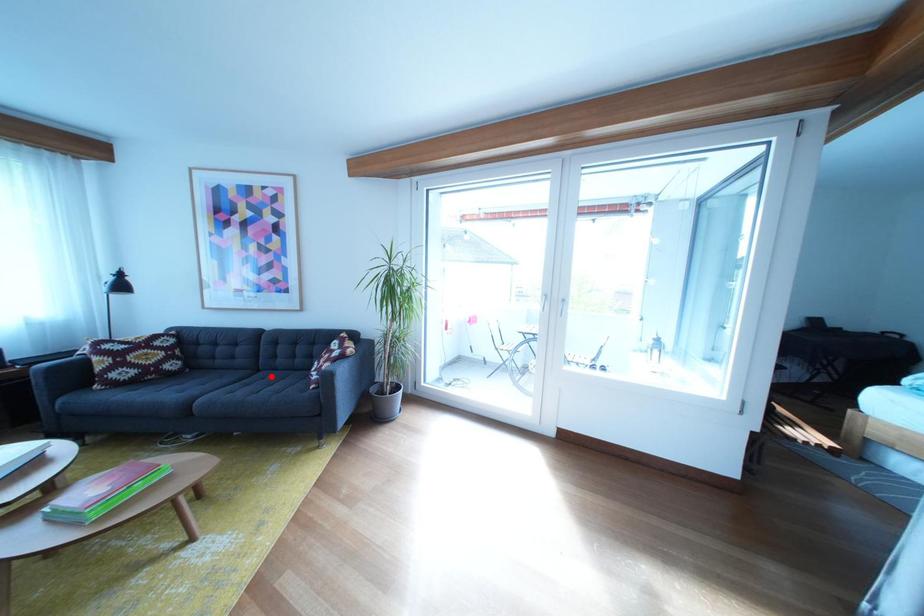
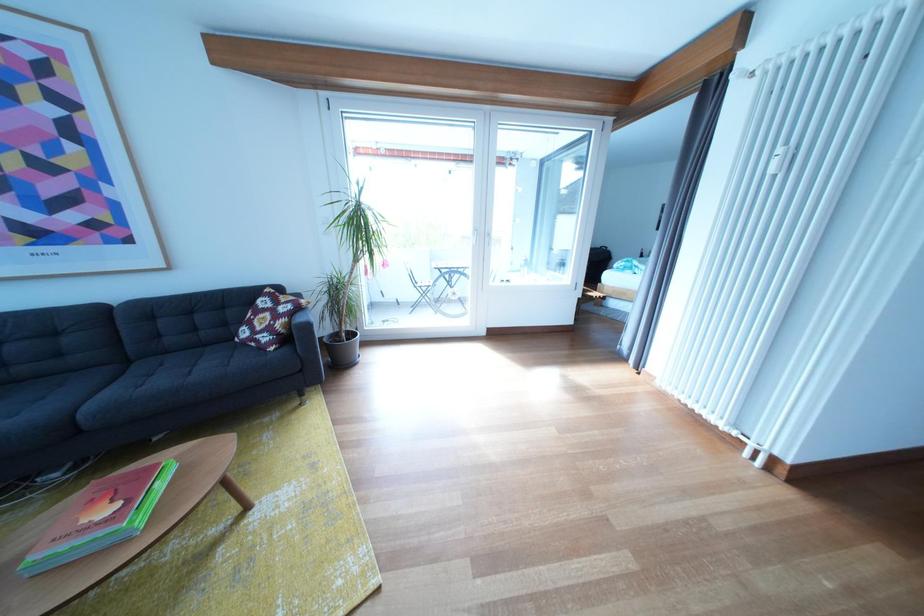
The point at the highlighted location is marked in the first image. Where is the corresponding point in the second image?

(141, 368)